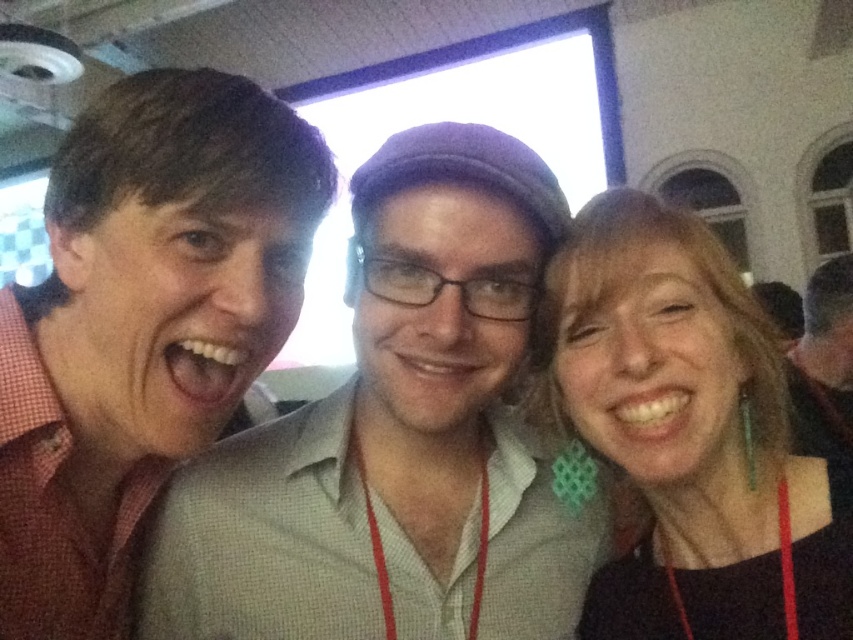
Can you confirm if matte red shirt at center is thinner than pink checkered shirt at left?

Incorrect, matte red shirt at center's width is not less than pink checkered shirt at left's.

Is matte red shirt at center positioned in front of pink checkered shirt at left?

No, matte red shirt at center is behind pink checkered shirt at left.

The width and height of the screenshot is (853, 640). I want to click on matte red shirt at center, so click(397, 436).

You are a GUI agent. You are given a task and a screenshot of the screen. Output one action in this format:
    pyautogui.click(x=<x>, y=<y>)
    Task: Click on the matte red shirt at center
    Image resolution: width=853 pixels, height=640 pixels.
    Given the screenshot: What is the action you would take?
    pyautogui.click(x=397, y=436)

Is pink checkered shirt at left closer to the viewer compared to black fabric earrings at right?

No, it is not.

Between point (241, 273) and point (733, 339), which one is positioned behind?

The point (733, 339) is more distant.

Measure the distance between point (62, 145) and camera.

They are 29.02 inches apart.

Image resolution: width=853 pixels, height=640 pixels. I want to click on pink checkered shirt at left, so click(142, 323).

Is matte red shirt at center further to camera compared to black fabric earrings at right?

Yes, it is behind black fabric earrings at right.

Between point (215, 454) and point (805, 634), which one is positioned in front?

Point (805, 634) is in front.

Identify the location of matte red shirt at center. (397, 436).